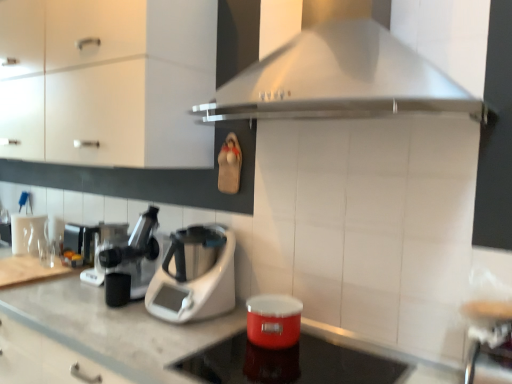
Question: Relative to metallic silver coffee machine at left, the third coffee machine in the right-to-left sequence, is shiny red container at center in front or behind?

Choices:
 (A) behind
 (B) front

Answer: (B)

Question: Considering the relative positions of shiny red container at center and metallic silver coffee machine at left, the third coffee machine in the right-to-left sequence, in the image provided, is shiny red container at center to the left or to the right of metallic silver coffee machine at left, the third coffee machine in the right-to-left sequence,?

Choices:
 (A) left
 (B) right

Answer: (B)

Question: Which object is positioned farthest from the matte white cabinet at upper left?

Choices:
 (A) black plastic coffee machine at left, positioned as the second coffee machine in front-to-back order
 (B) white plastic food processor at center
 (C) stainless steel range hood at upper center
 (D) white glossy countertop at center
 (E) white plastic coffee machine at center, which appears as the first coffee machine when viewed from the right

Answer: (D)

Question: Which object is the farthest from the white plastic coffee machine at center, which appears as the first coffee machine when viewed from the front?

Choices:
 (A) metallic silver bar stool at lower right
 (B) metallic silver coffee machine at left, the third coffee machine in the right-to-left sequence
 (C) shiny red container at center
 (D) black plastic coffee machine at left, positioned as the second coffee machine in front-to-back order
 (E) white glossy countertop at center

Answer: (A)